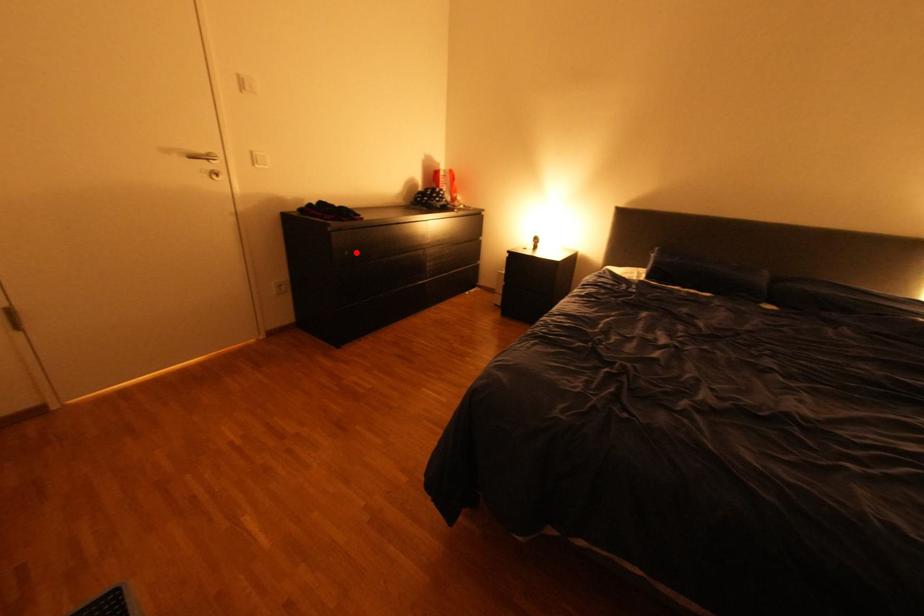
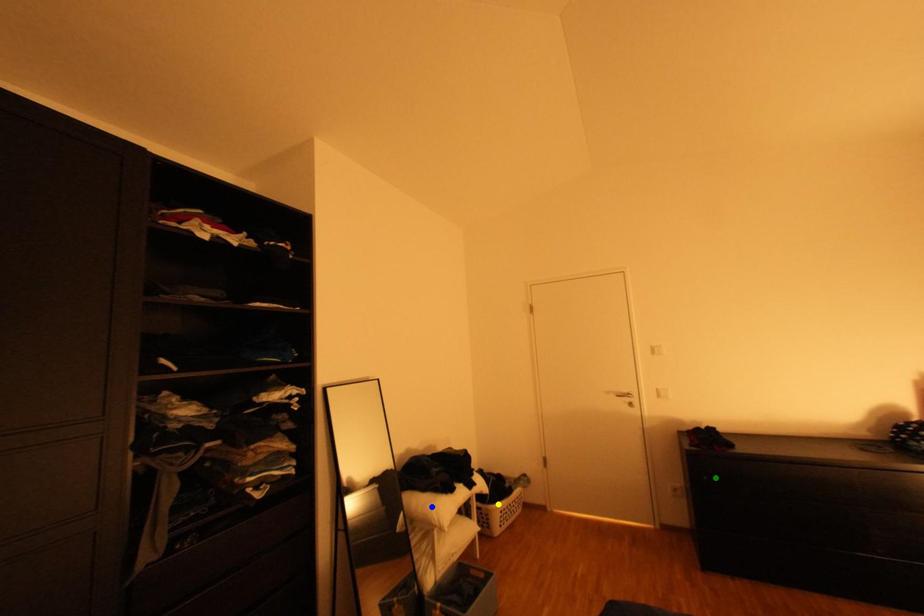
Question: I am providing you with two images of the same scene from different viewpoints. A red point is marked on the first image. You are given multiple points on the second image. Which point in image 2 represents the same 3d spot as the red point in image 1?

Choices:
 (A) blue point
 (B) green point
 (C) yellow point

Answer: (B)